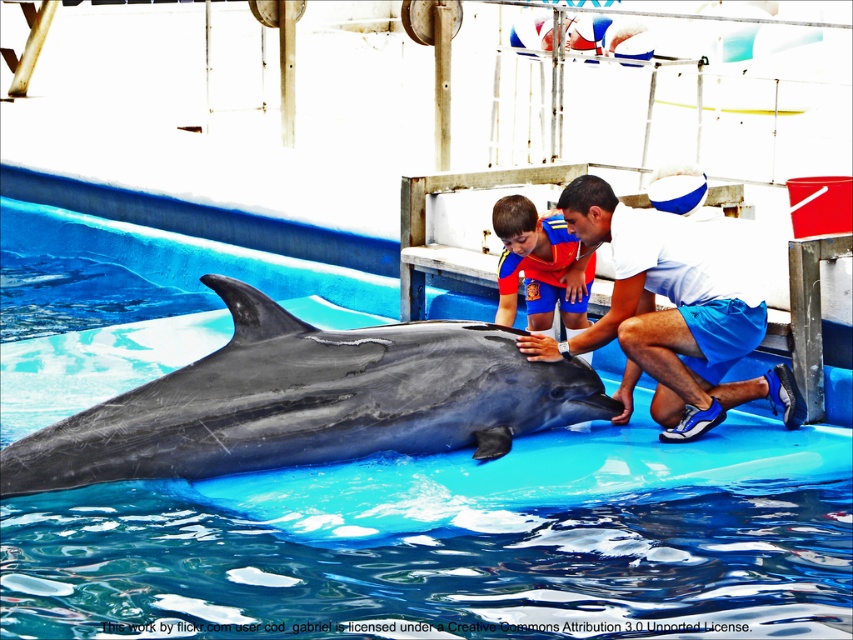
You are a safety inspector at the dolphin encounter area. You need to ensure that the gray smooth dolphin at center is not directly under the white matte shirt at center to prevent any accidental falls. Is the current positioning compliant with safety regulations?

The gray smooth dolphin at center is positioned under the white matte shirt at center, which violates the safety regulations as it could pose a fall hazard. The dolphin should be repositioned to ensure it is not directly underneath the shirt.